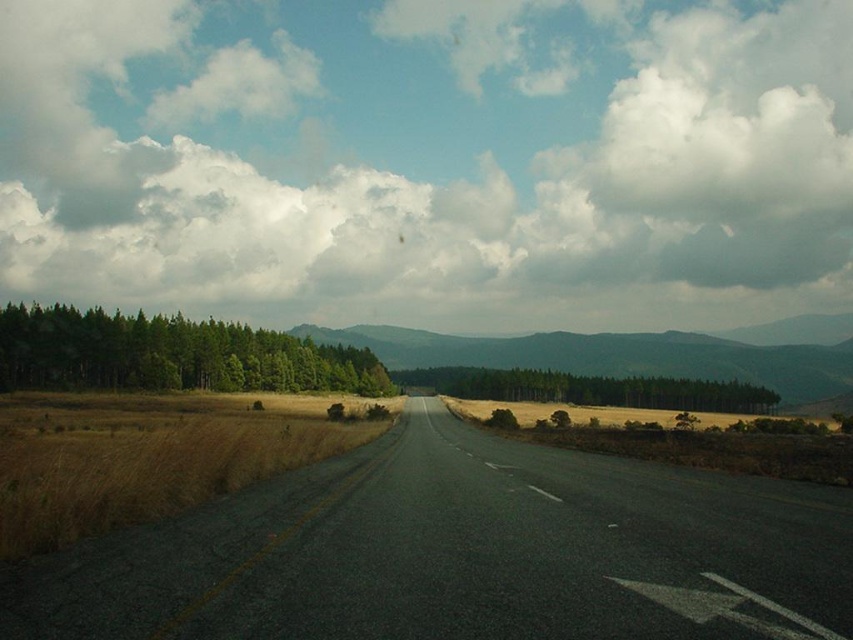
Between green forested mountain at center and green matte trees at center, which one has less height?

green matte trees at center

This screenshot has width=853, height=640. Describe the element at coordinates (634, 353) in the screenshot. I see `green forested mountain at center` at that location.

At what (x,y) coordinates should I click in order to perform the action: click on green forested mountain at center. Please return your answer as a coordinate pair (x, y). The image size is (853, 640). Looking at the image, I should click on (634, 353).

Between asphalt road at center and green forested mountain at center, which one appears on the right side from the viewer's perspective?

From the viewer's perspective, green forested mountain at center appears more on the right side.

Which of these two, asphalt road at center or green forested mountain at center, stands taller?

With more height is green forested mountain at center.

Does point (368, 493) lie in front of point (576, 349)?

Yes.

Locate an element on the screen. asphalt road at center is located at coordinates (461, 554).

Measure the distance between point (326,209) and camera.

Point (326,209) and camera are 948.44 feet apart from each other.

Does point (482, 288) lie in front of point (192, 346)?

No, it is behind (192, 346).

Is point (457, 68) closer to camera compared to point (83, 333)?

No, (457, 68) is behind (83, 333).

Locate an element on the screen. Image resolution: width=853 pixels, height=640 pixels. cloudy sky at upper center is located at coordinates (430, 161).